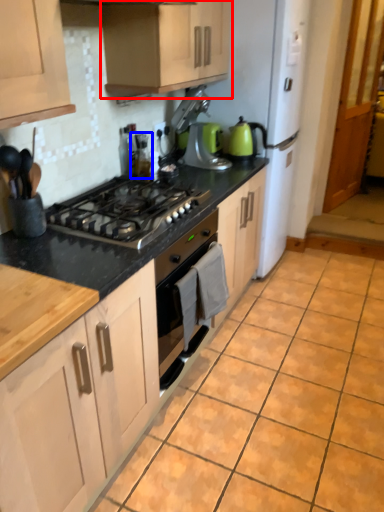
Question: Which object is further to the camera taking this photo, cabinetry (highlighted by a red box) or appliance (highlighted by a blue box)?

Choices:
 (A) cabinetry
 (B) appliance

Answer: (B)